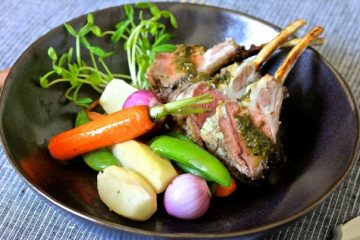
Where is `striped table cloth`? The image size is (360, 240). striped table cloth is located at coordinates (29, 212).